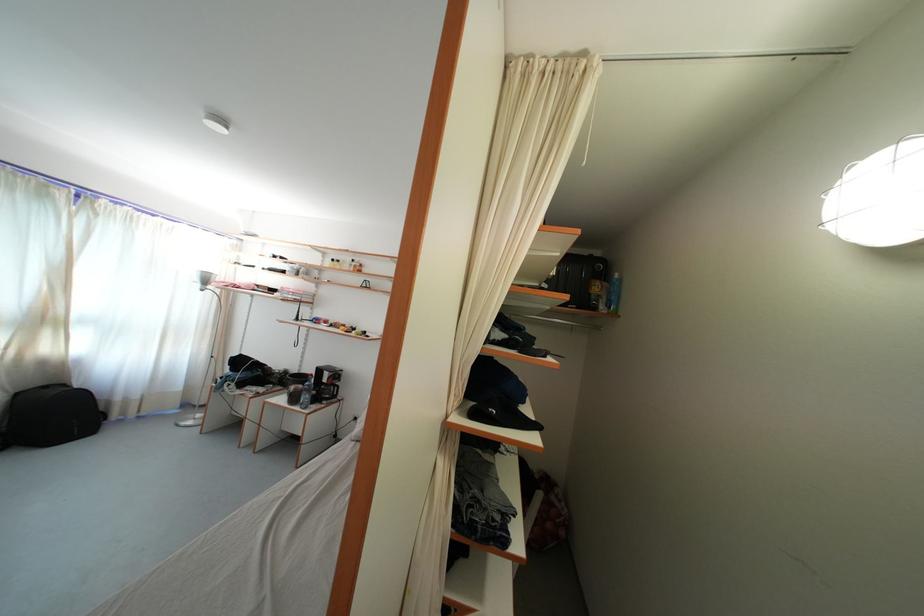
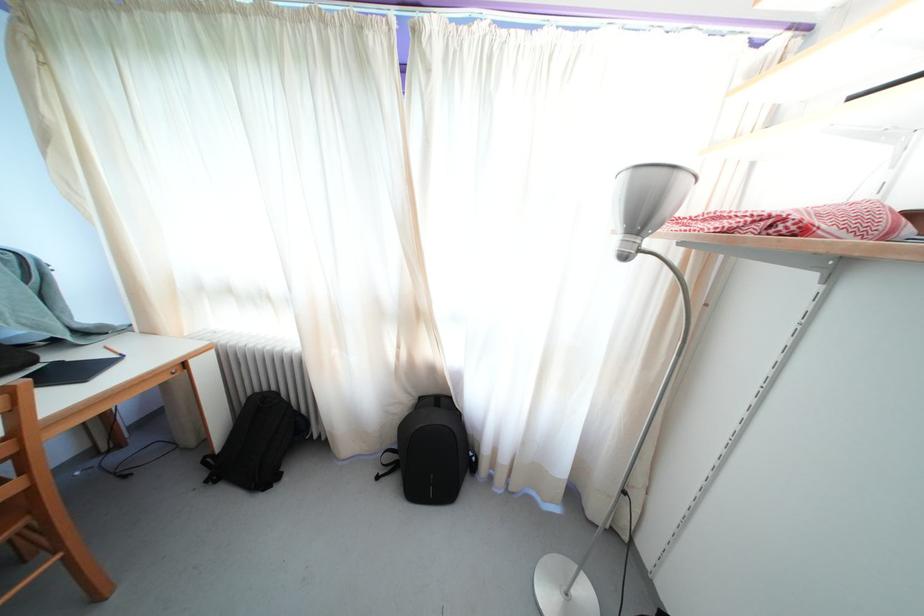
Locate, in the second image, the point that corresponds to point (52, 326) in the first image.

(421, 321)